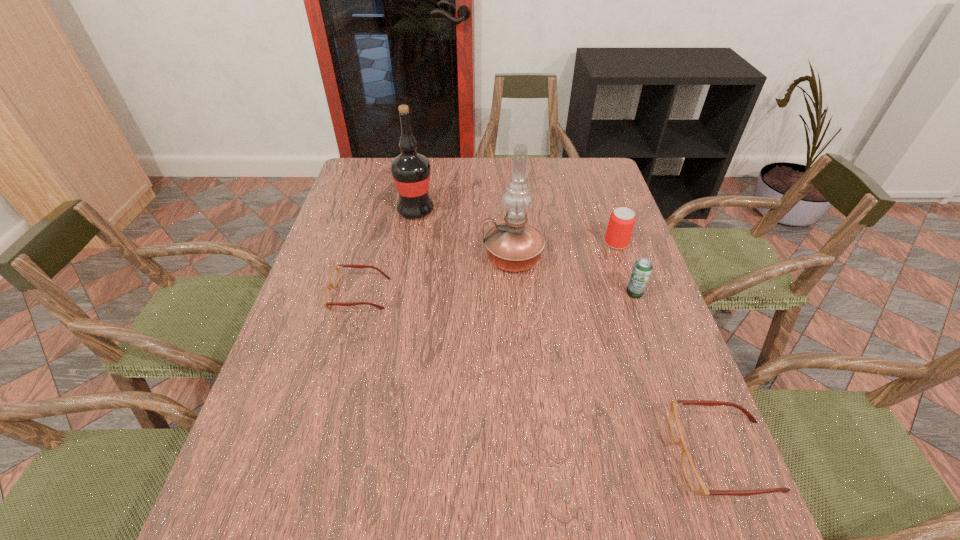
Find the location of `blank space located 0.270m on the front-facing side of the right spectacles`. blank space located 0.270m on the front-facing side of the right spectacles is located at coordinates (534, 455).

Identify the location of free space located on the right of the wine bottle. [x=450, y=211].

Locate an element on the screen. The height and width of the screenshot is (540, 960). free region located 0.070m on the front of the nearer beer can is located at coordinates point(644,320).

This screenshot has height=540, width=960. I want to click on free space located on the left of the fourth object from right to left, so click(349, 258).

Find the location of a particular element. The width and height of the screenshot is (960, 540). vacant position located 0.350m on the front of the farther beer can is located at coordinates (653, 348).

Find the location of `object at the near edge`. object at the near edge is located at coordinates (694, 480).

This screenshot has height=540, width=960. I want to click on object positioned at the left edge, so click(334, 276).

Locate an element on the screen. This screenshot has height=540, width=960. spectacles situated at the right edge is located at coordinates (694, 480).

Locate an element on the screen. Image resolution: width=960 pixels, height=540 pixels. object located in the near right corner section of the desktop is located at coordinates (694, 480).

You are a GUI agent. You are given a task and a screenshot of the screen. Output one action in this format:
    pyautogui.click(x=<x>, y=<y>)
    Task: Click on the vacant space at the far edge
    
    Given the screenshot: What is the action you would take?
    pyautogui.click(x=527, y=174)